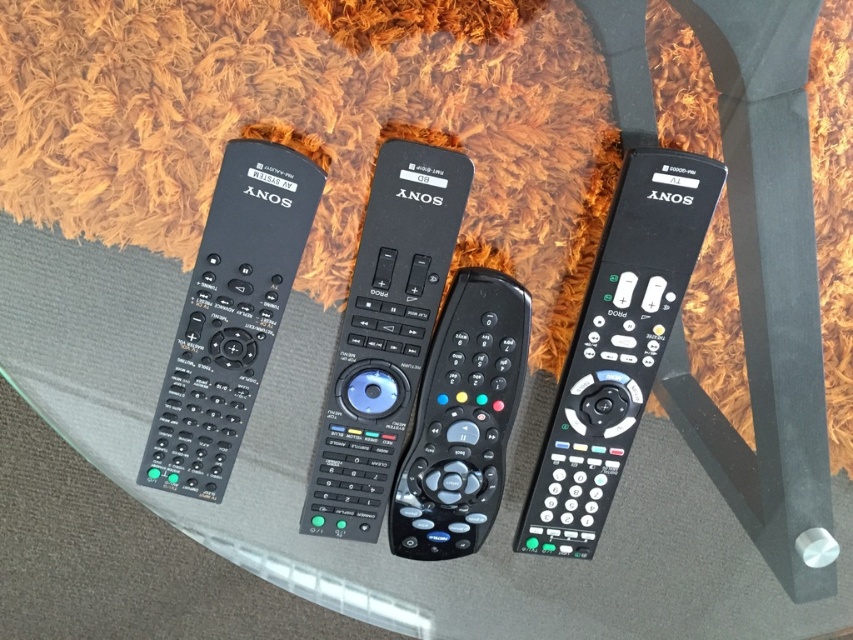
You are trying to locate the black plastic remote at right on the glass table. According to the coordinates provided, where would you find it relative to the center of the table?

The black plastic remote at right is located at point [618,346], which is to the right and slightly above the center of the table.

You have two remotes on a table. You need to pick up the wider one to control your TV. Which one should you choose between the black plastic remote at right and the black matte remote at left?

The black matte remote at left is wider than the black plastic remote at right, so you should choose the black matte remote at left to control your TV.